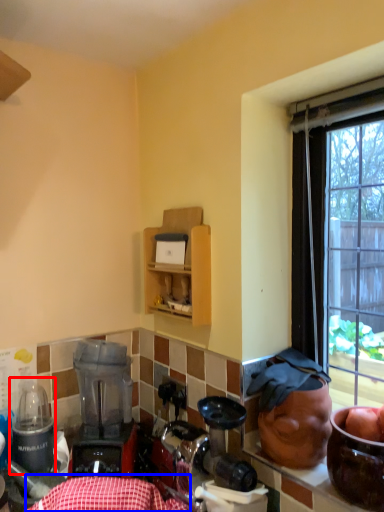
Question: Which object appears farthest to the camera in this image, appliance (highlighted by a red box) or tablecloth (highlighted by a blue box)?

Choices:
 (A) appliance
 (B) tablecloth

Answer: (A)